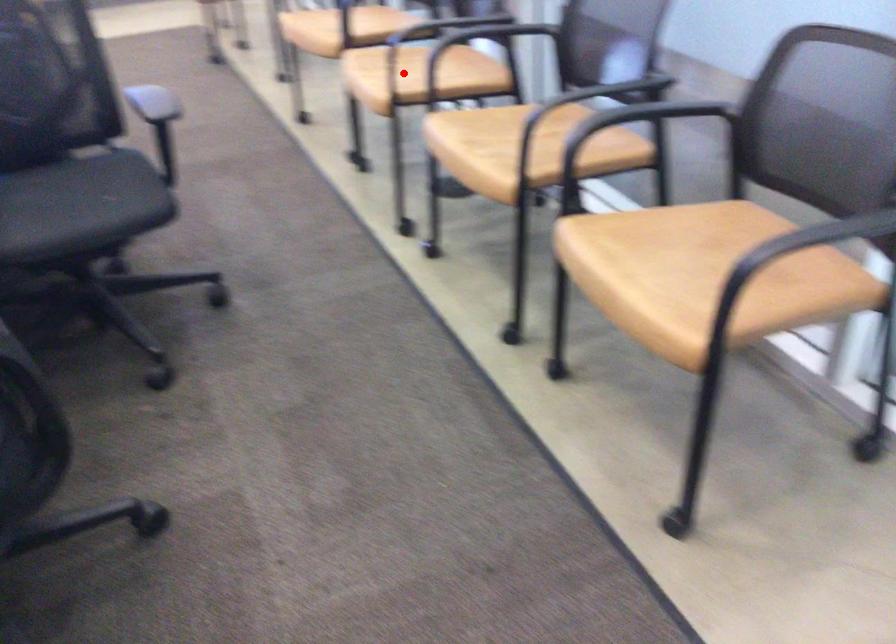
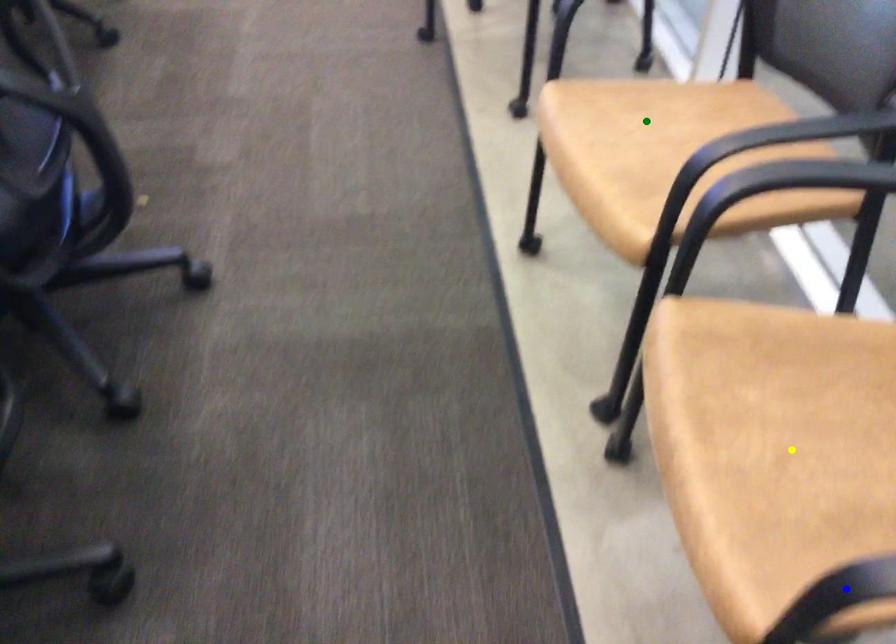
Question: I am providing you with two images of the same scene from different viewpoints. A red point is marked on the first image. You are given multiple points on the second image. Can you choose the point in image 2 that corresponds to the point in image 1?

Choices:
 (A) green point
 (B) yellow point
 (C) blue point

Answer: (B)